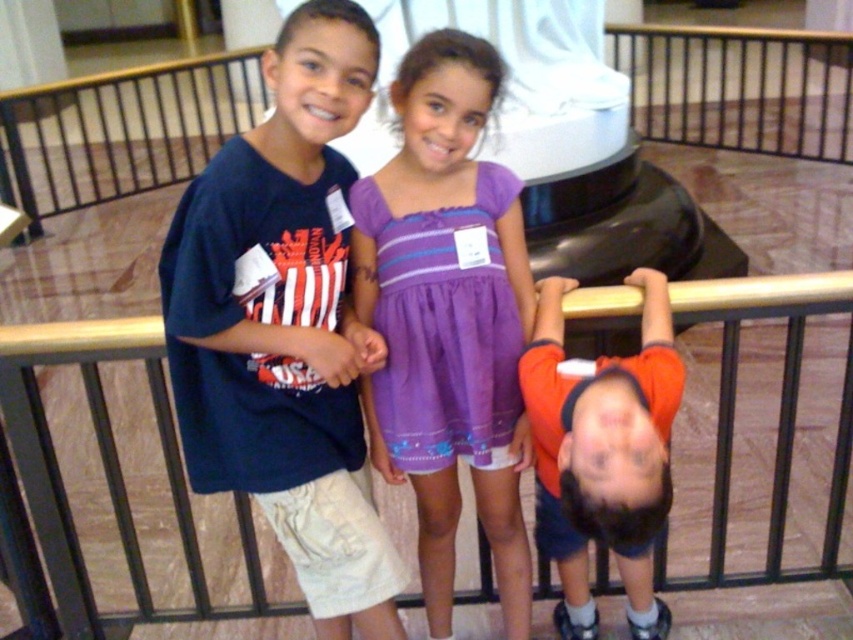
Looking at this image, is purple cotton dress at center smaller than gold metal railing at upper center?

Indeed, purple cotton dress at center has a smaller size compared to gold metal railing at upper center.

Is point (434, 476) positioned before point (752, 307)?

No, (434, 476) is behind (752, 307).

Locate an element on the screen. Image resolution: width=853 pixels, height=640 pixels. purple cotton dress at center is located at coordinates (448, 317).

Does dark blue t-shirt at upper left appear over purple cotton dress at center?

Indeed, dark blue t-shirt at upper left is positioned over purple cotton dress at center.

Who is shorter, dark blue t-shirt at upper left or purple cotton dress at center?

Standing shorter between the two is dark blue t-shirt at upper left.

The width and height of the screenshot is (853, 640). Describe the element at coordinates (286, 324) in the screenshot. I see `dark blue t-shirt at upper left` at that location.

Locate an element on the screen. dark blue t-shirt at upper left is located at coordinates (286, 324).

Does dark blue t-shirt at upper left have a greater height compared to gold metal railing at upper center?

Correct, dark blue t-shirt at upper left is much taller as gold metal railing at upper center.

The width and height of the screenshot is (853, 640). What do you see at coordinates (286, 324) in the screenshot? I see `dark blue t-shirt at upper left` at bounding box center [286, 324].

Image resolution: width=853 pixels, height=640 pixels. Identify the location of dark blue t-shirt at upper left. (286, 324).

Where is `dark blue t-shirt at upper left`? dark blue t-shirt at upper left is located at coordinates (286, 324).